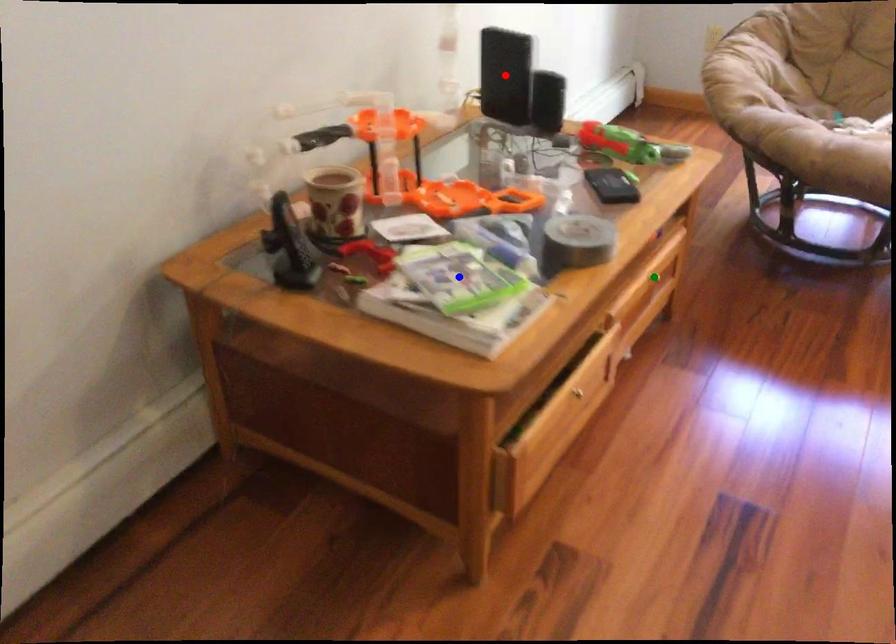
Order these from nearest to farthest:
A) green point
B) blue point
C) red point

blue point → green point → red point